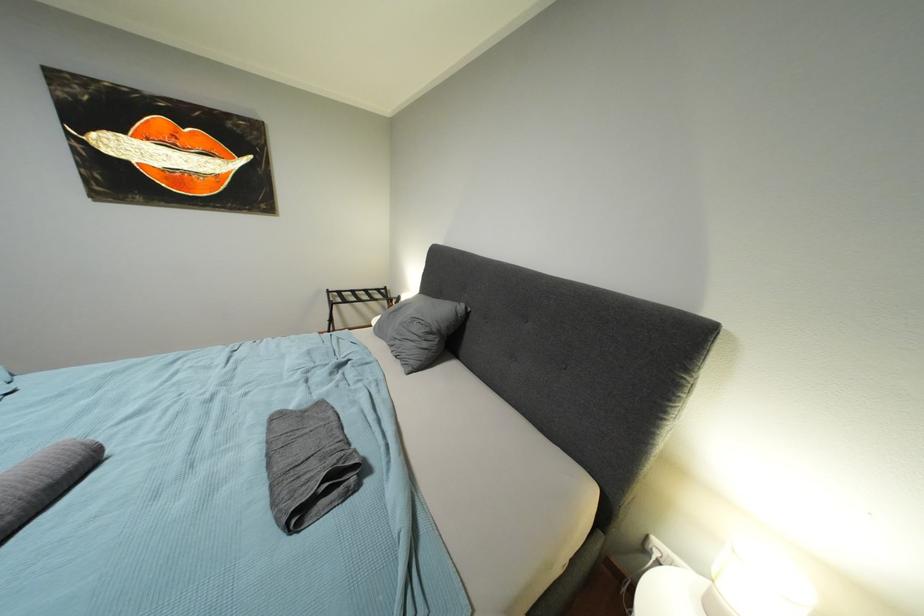
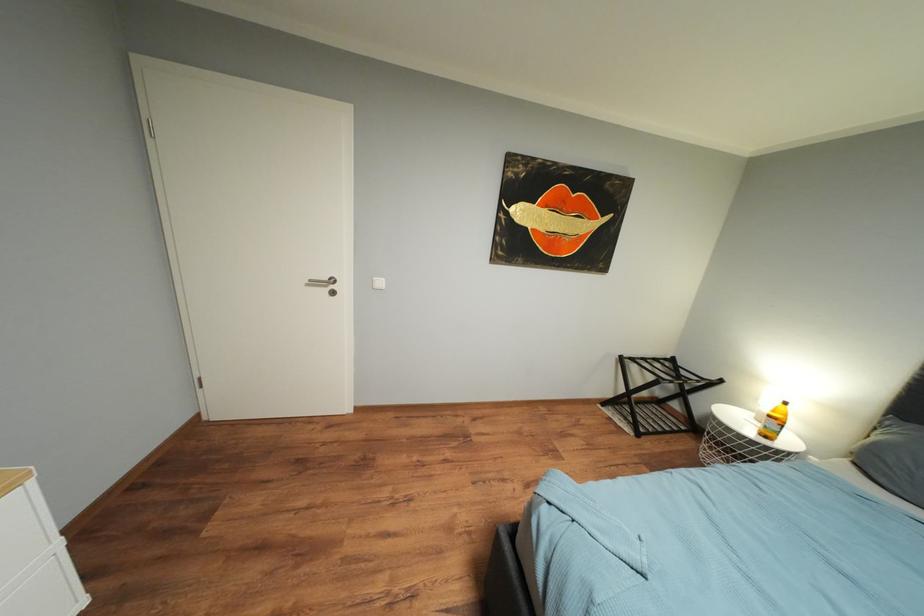
Question: What movement of the cameraman would produce the second image?

Choices:
 (A) Left
 (B) Right
 (C) Forward
 (D) Backward

Answer: (A)